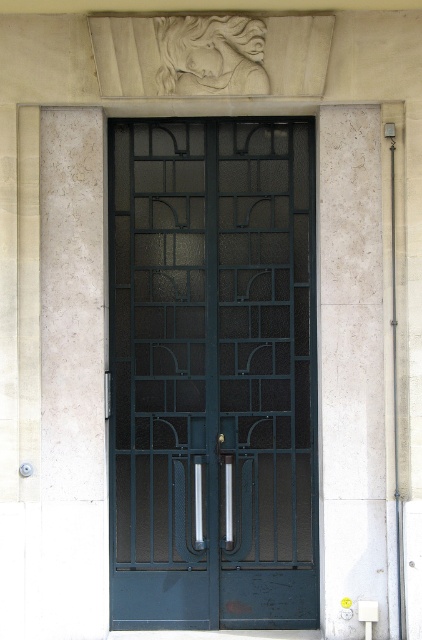
Which is behind, point (254, 496) or point (370, 371)?

The point (254, 496) is behind.

Does dark blue glass door at center have a greater width compared to white marble pillar at right?

Yes.

Find the location of a particular element. dark blue glass door at center is located at coordinates (213, 372).

Is white marble pillar at left closer to camera compared to white marble pillar at right?

No, it is behind white marble pillar at right.

Is point (100, 168) less distant than point (351, 625)?

No, (100, 168) is further to viewer.

Which is behind, point (100, 460) or point (330, 236)?

The point (100, 460) is behind.

Locate an element on the screen. white marble pillar at left is located at coordinates (72, 378).

Between dark blue glass door at center and white marble pillar at left, which one has less height?

With less height is dark blue glass door at center.

Measure the distance between dark blue glass door at center and camera.

dark blue glass door at center is 6.72 meters away from camera.

At what (x,y) coordinates should I click in order to perform the action: click on dark blue glass door at center. Please return your answer as a coordinate pair (x, y). The height and width of the screenshot is (640, 422). Looking at the image, I should click on (213, 372).

Identify the location of dark blue glass door at center. (213, 372).